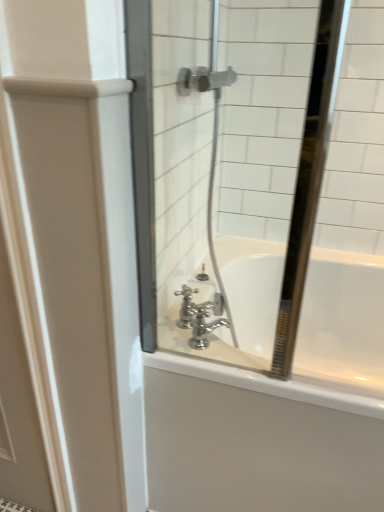
In order to click on clear glass mirror at center in this screenshot , I will do `click(262, 181)`.

From the image's perspective, relative to chrome metallic faucet at center, is clear glass mirror at center above or below?

Based on their image positions, clear glass mirror at center is located above chrome metallic faucet at center.

Between clear glass mirror at center and chrome metallic faucet at center, which one has larger width?

clear glass mirror at center is wider.

Is point (304, 354) in front of point (184, 287)?

No, (304, 354) is further to viewer.

From the image's perspective, does white glossy door at left appear higher than white glossy bathtub at center?

Correct, white glossy door at left appears higher than white glossy bathtub at center in the image.

Is white glossy door at left taller or shorter than white glossy bathtub at center?

Clearly, white glossy door at left is taller compared to white glossy bathtub at center.

Does white glossy door at left appear on the right side of white glossy bathtub at center?

No.

How many degrees apart are the facing directions of white glossy door at left and white glossy bathtub at center?

0.65 degrees separate the facing orientations of white glossy door at left and white glossy bathtub at center.

Is polished chrome faucet at center located within chrome metallic faucet at center?

Definitely not — polished chrome faucet at center is not inside chrome metallic faucet at center.

Considering the sizes of objects chrome metallic faucet at center and polished chrome faucet at center in the image provided, who is bigger, chrome metallic faucet at center or polished chrome faucet at center?

chrome metallic faucet at center is bigger.

From a real-world perspective, is chrome metallic faucet at center beneath polished chrome faucet at center?

Incorrect, from a real-world perspective, chrome metallic faucet at center is higher than polished chrome faucet at center.

Considering their positions, is chrome metallic faucet at center located in front of or behind polished chrome faucet at center?

Visually, chrome metallic faucet at center is located in front of polished chrome faucet at center.

Would you say white glossy door at left contains clear glass mirror at center?

No.

Which point is more forward, (55, 381) or (148, 32)?

The point (148, 32) is in front.

In the scene shown: From a real-world perspective, is white glossy door at left located higher than clear glass mirror at center?

Incorrect, from a real-world perspective, white glossy door at left is lower than clear glass mirror at center.

Considering the sizes of objects white glossy door at left and clear glass mirror at center in the image provided, who is bigger, white glossy door at left or clear glass mirror at center?

Bigger between the two is clear glass mirror at center.

Is point (181, 309) positioned behind point (344, 400)?

Yes, it is behind point (344, 400).

Considering the sizes of objects polished chrome faucet at center and white glossy bathtub at center in the image provided, who is shorter, polished chrome faucet at center or white glossy bathtub at center?

Standing shorter between the two is polished chrome faucet at center.

Which of these two, polished chrome faucet at center or white glossy bathtub at center, is bigger?

With larger size is white glossy bathtub at center.

Can you confirm if clear glass mirror at center is positioned to the right of white glossy bathtub at center?

No, clear glass mirror at center is not to the right of white glossy bathtub at center.

Looking at this image, is clear glass mirror at center oriented away from white glossy bathtub at center?

No, clear glass mirror at center's orientation is not away from white glossy bathtub at center.

From a real-world perspective, between clear glass mirror at center and white glossy bathtub at center, who is vertically higher?

In real-world perspective, clear glass mirror at center is above.

Which of these two, clear glass mirror at center or white glossy bathtub at center, stands shorter?

white glossy bathtub at center.

Is white glossy bathtub at center not inside clear glass mirror at center?

Yes, white glossy bathtub at center is located beyond the bounds of clear glass mirror at center.

Is white glossy bathtub at center with clear glass mirror at center?

white glossy bathtub at center is not next to clear glass mirror at center, and they're not touching.

Between point (149, 470) and point (141, 55), which one is positioned in front?

The point (141, 55) is closer to the camera.

Image resolution: width=384 pixels, height=512 pixels. In the image, there is a chrome metallic faucet at center. What are the coordinates of `mirror above it (from the image's perspective)` in the screenshot? It's located at (262, 181).

The image size is (384, 512). Identify the location of bathtub behind the white glossy door at left. (257, 441).

Based on their spatial positions, is polished chrome faucet at center or white glossy bathtub at center closer to white glossy door at left?

Based on the image, white glossy bathtub at center appears to be nearer to white glossy door at left.

Considering their positions, is white glossy bathtub at center positioned closer to white glossy door at left than chrome metallic faucet at center?

white glossy bathtub at center.

Consider the image. Considering their positions, is chrome metallic faucet at center positioned further to clear glass mirror at center than white glossy bathtub at center?

white glossy bathtub at center.

Which object lies nearer to the anchor point clear glass mirror at center, chrome metallic faucet at center or white glossy door at left?

chrome metallic faucet at center lies closer to clear glass mirror at center than the other object.

Looking at the image, which one is located closer to white glossy door at left, chrome metallic faucet at center or polished chrome faucet at center?

Among the two, chrome metallic faucet at center is located nearer to white glossy door at left.

Looking at the image, which one is located further to white glossy bathtub at center, polished chrome faucet at center or clear glass mirror at center?

The object further to white glossy bathtub at center is clear glass mirror at center.

Based on their spatial positions, is white glossy door at left or white glossy bathtub at center closer to polished chrome faucet at center?

Among the two, white glossy bathtub at center is located nearer to polished chrome faucet at center.

Estimate the real-world distances between objects in this image. Which object is closer to clear glass mirror at center, white glossy bathtub at center or chrome metallic faucet at center?

chrome metallic faucet at center is closer to clear glass mirror at center.

Where is `tap between white glossy door at left and polished chrome faucet at center along the z-axis`? tap between white glossy door at left and polished chrome faucet at center along the z-axis is located at coordinates (200, 316).

Where is `tap situated between white glossy door at left and white glossy bathtub at center from left to right`? The image size is (384, 512). tap situated between white glossy door at left and white glossy bathtub at center from left to right is located at coordinates point(200,316).

Where is `tap located between clear glass mirror at center and polished chrome faucet at center in the depth direction`? The height and width of the screenshot is (512, 384). tap located between clear glass mirror at center and polished chrome faucet at center in the depth direction is located at coordinates (200, 316).

This screenshot has width=384, height=512. Identify the location of tap between clear glass mirror at center and white glossy bathtub at center in the up-down direction. (200, 316).